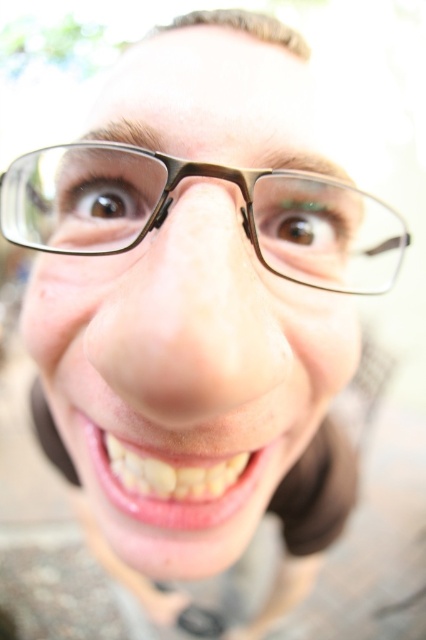
Question: Which object is positioned closest to the glossy pink lips at center?

Choices:
 (A) matte brown glasses at center
 (B) transparent plastic glasses at center

Answer: (A)

Question: Is transparent plastic glasses at center smaller than glossy pink lips at center?

Choices:
 (A) yes
 (B) no

Answer: (B)

Question: Considering the real-world distances, which object is closest to the glossy pink lips at center?

Choices:
 (A) transparent plastic glasses at center
 (B) matte brown glasses at center

Answer: (B)

Question: Does matte brown glasses at center appear under transparent plastic glasses at center?

Choices:
 (A) no
 (B) yes

Answer: (B)

Question: Which is farther from the glossy pink lips at center?

Choices:
 (A) matte brown glasses at center
 (B) transparent plastic glasses at center

Answer: (B)

Question: Is transparent plastic glasses at center in front of glossy pink lips at center?

Choices:
 (A) yes
 (B) no

Answer: (A)